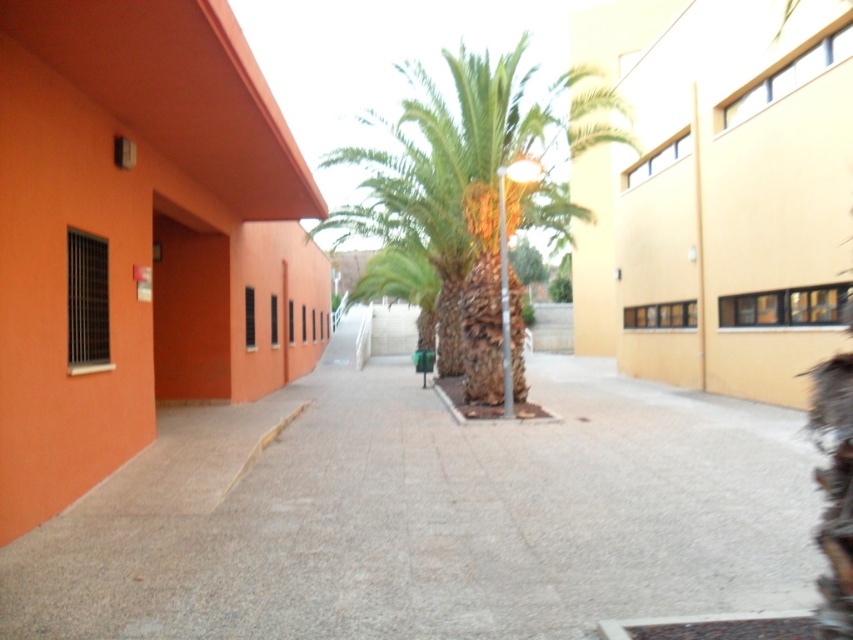
You are standing at the entrance of the vibrant orange building on the left. You want to walk to the beige or light yellow building on the right. Which direction should you walk relative to the gray concrete pavement at center?

Since the gray concrete pavement at center is located at point (428, 516) in the image, you should walk towards the beige or light yellow building on the right by moving along the gray concrete pavement at center towards its eastern direction.

You are a delivery person trying to navigate through the gray concrete pavement at center between the two buildings. There is a green leafy palm at center in the middle of the path. Can you pass through the path without going around the palm?

The gray concrete pavement at center is narrower than the green leafy palm at center, so there might not be enough space to pass through without going around the palm.

You are standing at the entrance of the vibrant orange building on the left and want to walk to the beige building on the right. Which object should you step on first, the gray concrete pavement at center or the green leafy palm at center?

You should step on the gray concrete pavement at center first because it is located to the left of the green leafy palm at center, meaning it is closer to your starting position at the orange building.